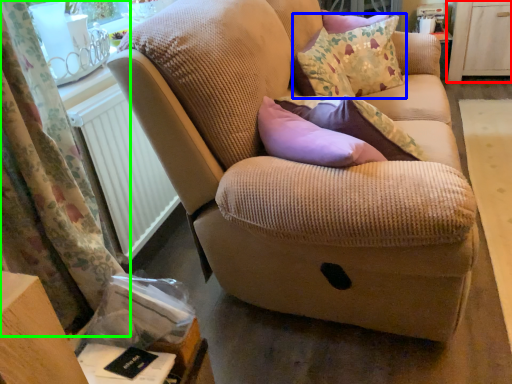
Question: Considering the real-world distances, which object is farthest from dresser (highlighted by a red box)? throw pillow (highlighted by a blue box) or curtain (highlighted by a green box)?

Choices:
 (A) throw pillow
 (B) curtain

Answer: (B)